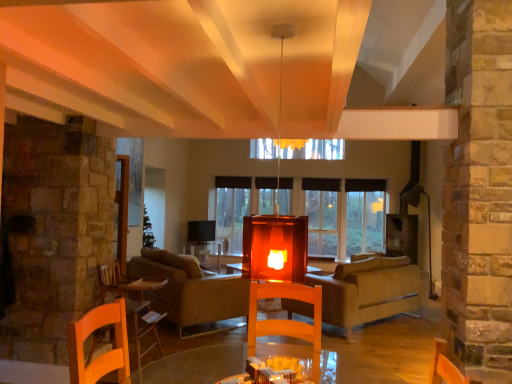
Identify the location of velvet beige couch at center. (190, 289).

Is there a large distance between wooden table at lower left and beige fabric couch at center?

Absolutely, wooden table at lower left is distant from beige fabric couch at center.

Is wooden table at lower left facing away from beige fabric couch at center?

→ No.

Does point (143, 288) lie behind point (366, 268)?

No, it is in front of (366, 268).

Which is behind, transparent glass window at center or wooden table at lower left?

transparent glass window at center is behind.

Is transparent glass window at center thinner than wooden table at lower left?

Correct, the width of transparent glass window at center is less than that of wooden table at lower left.

Can you confirm if transparent glass window at center is shorter than wooden table at lower left?

No.

From the image's perspective, is transparent glass window at center under wooden table at lower left?

No, from the image's perspective, transparent glass window at center is not beneath wooden table at lower left.

From a real-world perspective, is beige fabric couch at center positioned above or below velvet beige couch at center?

In terms of real-world spatial position, beige fabric couch at center is above velvet beige couch at center.

Which is in front, beige fabric couch at center or velvet beige couch at center?

velvet beige couch at center is more forward.

Is beige fabric couch at center oriented towards velvet beige couch at center?

No, beige fabric couch at center is not aimed at velvet beige couch at center.

Does beige fabric couch at center have a lesser height compared to velvet beige couch at center?

Indeed, beige fabric couch at center has a lesser height compared to velvet beige couch at center.

Can you tell me how much wooden table at lower left and velvet beige couch at center differ in facing direction?

The angular difference between wooden table at lower left and velvet beige couch at center is 47.8 degrees.

Which point is more distant from viewer, (102, 301) or (223, 318)?

The point (223, 318) is more distant.

Which is more to the left, wooden table at lower left or velvet beige couch at center?

Positioned to the left is wooden table at lower left.

From a real-world perspective, relative to velvet beige couch at center, is wooden table at lower left vertically above or below?

In terms of real-world spatial position, wooden table at lower left is above velvet beige couch at center.

Is beige fabric couch at center to the right of wooden table at lower left from the viewer's perspective?

Yes.

Consider the image. Can you confirm if beige fabric couch at center is thinner than wooden table at lower left?

Incorrect, the width of beige fabric couch at center is not less than that of wooden table at lower left.

From the image's perspective, which is below, beige fabric couch at center or wooden table at lower left?

beige fabric couch at center, from the image's perspective.

Can you confirm if beige fabric couch at center is smaller than wooden table at lower left?

Actually, beige fabric couch at center might be larger than wooden table at lower left.

Can we say wooden table at lower left lies outside transparent glass window at center?

That's correct, wooden table at lower left is outside of transparent glass window at center.

The image size is (512, 384). Find the location of `window that is above the wooden table at lower left (from the image's perspective)`. window that is above the wooden table at lower left (from the image's perspective) is located at coordinates (309, 211).

Between wooden table at lower left and transparent glass window at center, which one has larger size?

transparent glass window at center.

Does point (105, 266) come in front of point (237, 236)?

Yes, point (105, 266) is in front of point (237, 236).

From a real-world perspective, is beige fabric couch at center physically below transparent glass window at center?

Correct, in the physical world, beige fabric couch at center is lower than transparent glass window at center.

Is beige fabric couch at center looking in the opposite direction of transparent glass window at center?

No, beige fabric couch at center is not facing the opposite direction of transparent glass window at center.

Which is behind, beige fabric couch at center or transparent glass window at center?

transparent glass window at center is further from the camera.

Can you confirm if beige fabric couch at center is thinner than transparent glass window at center?

In fact, beige fabric couch at center might be wider than transparent glass window at center.

Locate an element on the screen. The width and height of the screenshot is (512, 384). table above the beige fabric couch at center (from the image's perspective) is located at coordinates (133, 304).

Identify the location of table below the transparent glass window at center (from the image's perspective). (133, 304).

Considering their positions, is transparent glass window at center positioned further to beige fabric couch at center than wooden table at lower left?

wooden table at lower left.

Which object lies nearer to the anchor point velvet beige couch at center, transparent glass window at center or wooden table at lower left?

Among the two, wooden table at lower left is located nearer to velvet beige couch at center.

Which object lies further to the anchor point beige fabric couch at center, velvet beige couch at center or wooden table at lower left?

Among the two, wooden table at lower left is located further to beige fabric couch at center.

Considering their positions, is transparent glass window at center positioned closer to wooden table at lower left than velvet beige couch at center?

velvet beige couch at center.

Looking at this image, considering their positions, is wooden table at lower left positioned further to velvet beige couch at center than beige fabric couch at center?

beige fabric couch at center is further to velvet beige couch at center.

Looking at the image, which one is located closer to beige fabric couch at center, velvet beige couch at center or transparent glass window at center?

Based on the image, transparent glass window at center appears to be nearer to beige fabric couch at center.

Looking at the image, which one is located further to transparent glass window at center, velvet beige couch at center or wooden table at lower left?

The object further to transparent glass window at center is wooden table at lower left.

Considering their positions, is beige fabric couch at center positioned closer to velvet beige couch at center than transparent glass window at center?

beige fabric couch at center.

This screenshot has height=384, width=512. What are the coordinates of `studio couch located between wooden table at lower left and transparent glass window at center in the depth direction` in the screenshot? It's located at (368, 291).

Identify the location of couch between wooden table at lower left and beige fabric couch at center in the horizontal direction. (190, 289).

The height and width of the screenshot is (384, 512). What are the coordinates of `studio couch between velvet beige couch at center and transparent glass window at center in the front-back direction` in the screenshot? It's located at (368, 291).

Where is `couch positioned between wooden table at lower left and transparent glass window at center from near to far`? couch positioned between wooden table at lower left and transparent glass window at center from near to far is located at coordinates (190, 289).